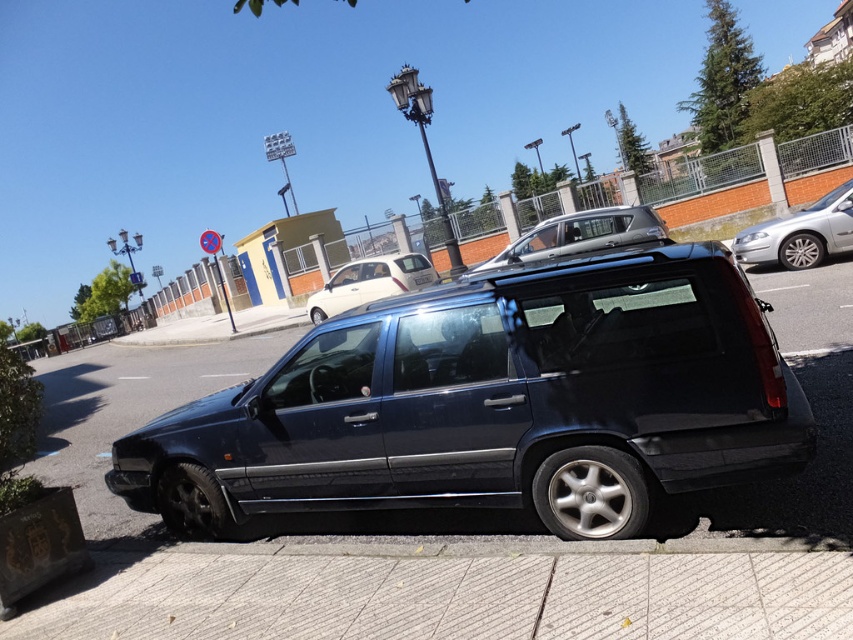
Question: Which of the following is the closest to the observer?

Choices:
 (A) (424, 280)
 (B) (564, 236)
 (C) (364, 364)

Answer: (C)

Question: Can you confirm if gray concrete pavement at lower center is positioned to the right of silver metallic sedan at right?

Choices:
 (A) no
 (B) yes

Answer: (A)

Question: Among these objects, which one is nearest to the camera?

Choices:
 (A) white plastic license plate at center
 (B) gray concrete pavement at lower center
 (C) white glossy hatchback at center
 (D) silver metallic sedan at right

Answer: (B)

Question: Which point is farther from the camera taking this photo?

Choices:
 (A) (426, 282)
 (B) (387, 262)
 (C) (604, 221)

Answer: (A)

Question: Does gray concrete pavement at lower center appear on the left side of white plastic license plate at center?

Choices:
 (A) yes
 (B) no

Answer: (A)

Question: Can you confirm if white glossy hatchback at center is wider than white plastic license plate at center?

Choices:
 (A) no
 (B) yes

Answer: (B)